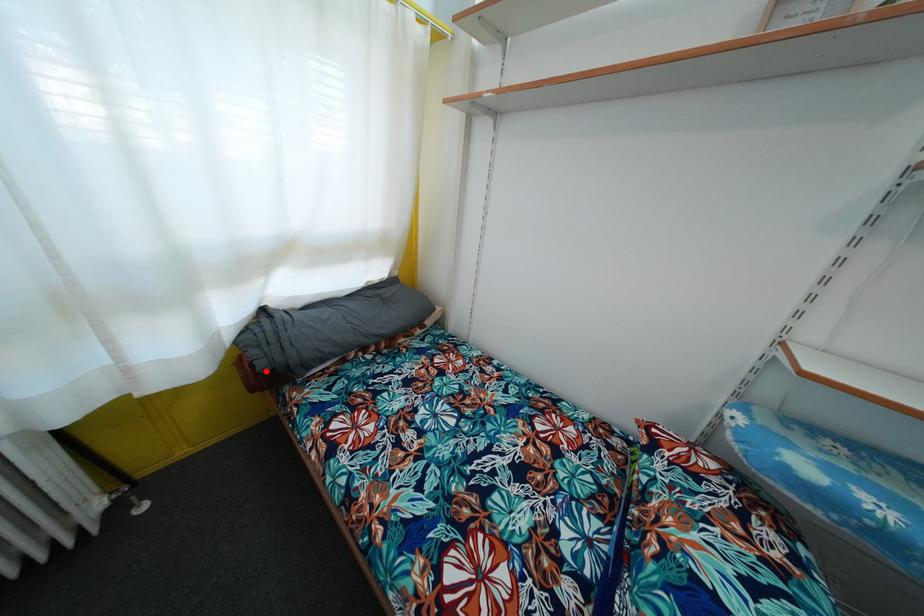
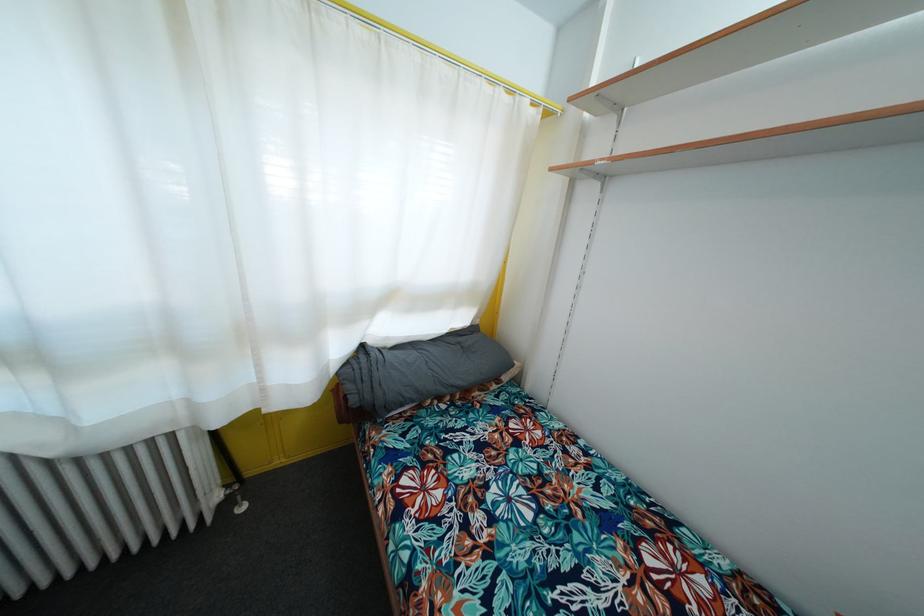
Where in the second image is the point corresponding to the highlighted location from the first image?

(358, 407)